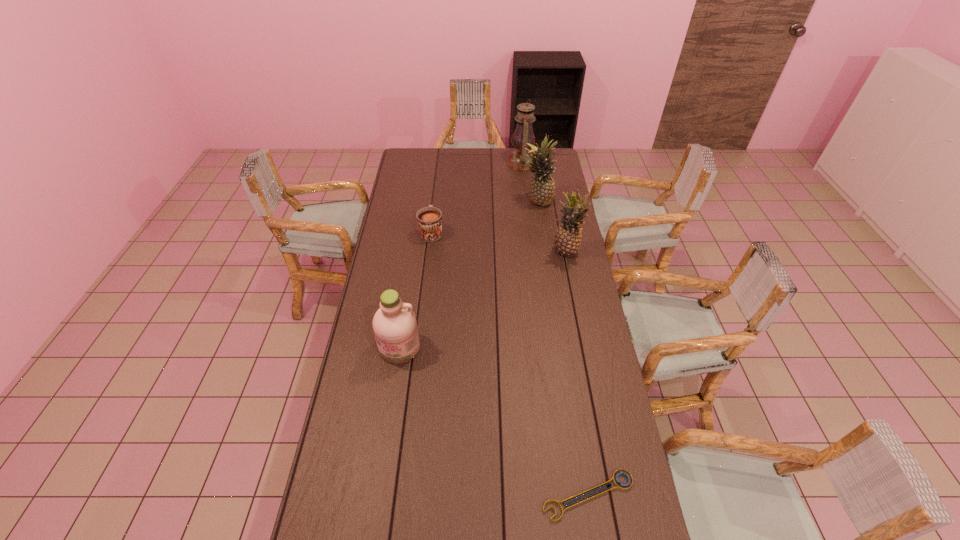
Where is `free space at the far edge`? This screenshot has width=960, height=540. free space at the far edge is located at coordinates (445, 171).

In the image, there is a desktop. Identify the location of free space at the left edge. (403, 188).

Where is `vacant region at the right edge`? The image size is (960, 540). vacant region at the right edge is located at coordinates (607, 390).

Where is `free space between the cleansing agent and the wrench`? The height and width of the screenshot is (540, 960). free space between the cleansing agent and the wrench is located at coordinates (494, 421).

Identify the location of vacant space in between the oil lamp and the nearest object. The height and width of the screenshot is (540, 960). (555, 329).

Identify the location of empty location between the farther pineapple and the nearer pineapple. The width and height of the screenshot is (960, 540). (552, 227).

Locate an element on the screen. The height and width of the screenshot is (540, 960). unoccupied area between the fifth nearest object and the nearer pineapple is located at coordinates (552, 227).

Where is `empty space that is in between the second farthest object and the wrench`? The width and height of the screenshot is (960, 540). empty space that is in between the second farthest object and the wrench is located at coordinates (563, 349).

This screenshot has width=960, height=540. What are the coordinates of `unoccupied position between the nearest object and the oil lamp` in the screenshot? It's located at (555, 329).

This screenshot has width=960, height=540. Find the location of `vacant region between the farthest object and the nearer pineapple`. vacant region between the farthest object and the nearer pineapple is located at coordinates (543, 208).